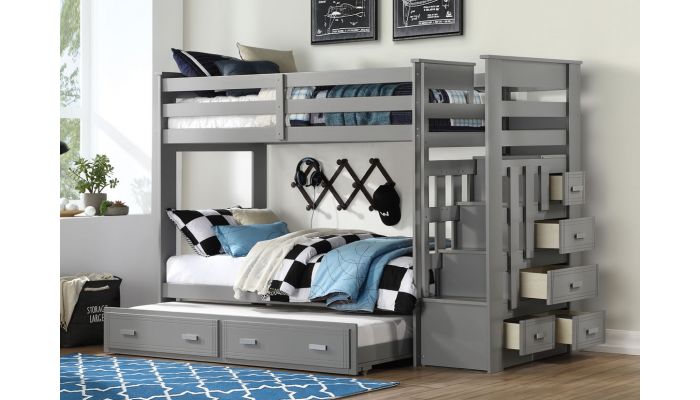
The height and width of the screenshot is (400, 700). What are the coordinates of `drawer` in the screenshot? It's located at (266, 337).